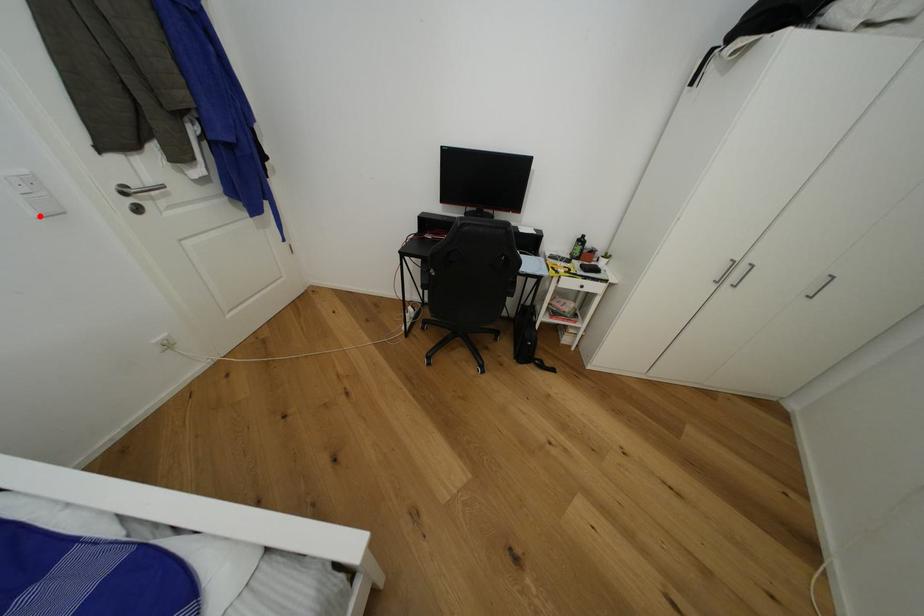
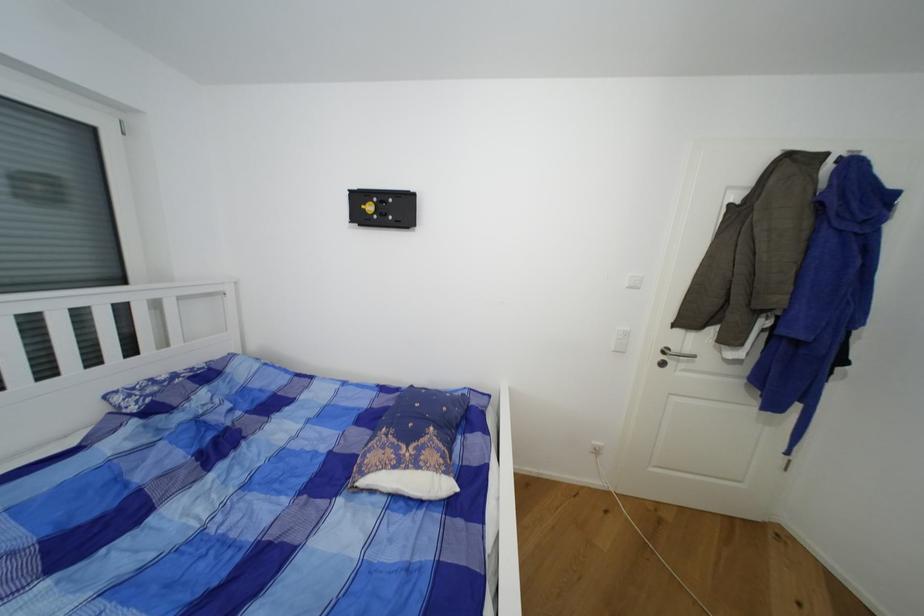
Find the pixel in the second image that matches the highlighted location in the first image.

(617, 351)